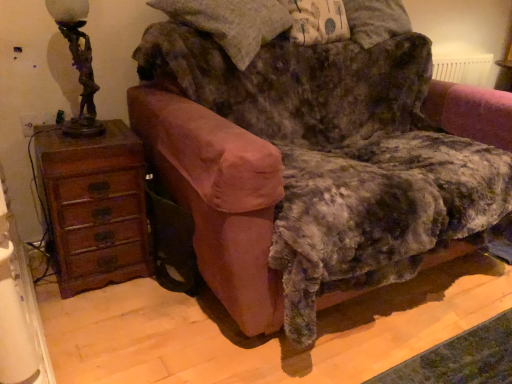
This screenshot has height=384, width=512. What are the coordinates of `bronze statue-like at left` in the screenshot? It's located at (78, 63).

In order to click on brown wooden chest of drawers at left in this screenshot , I will do `click(95, 206)`.

Could you tell me if bronze statue-like at left is facing brown wooden chest of drawers at left?

No, bronze statue-like at left is not aimed at brown wooden chest of drawers at left.

Is bronze statue-like at left next to brown wooden chest of drawers at left and touching it?

They are not placed beside each other.

Is bronze statue-like at left taller or shorter than brown wooden chest of drawers at left?

Considering their sizes, bronze statue-like at left has less height than brown wooden chest of drawers at left.

Considering the relative sizes of bronze statue-like at left and brown wooden chest of drawers at left in the image provided, is bronze statue-like at left bigger than brown wooden chest of drawers at left?

No.

Are brown wooden chest of drawers at left and bronze statue-like at left far apart?

No, brown wooden chest of drawers at left is not far from bronze statue-like at left.

Is brown wooden chest of drawers at left situated inside bronze statue-like at left or outside?

brown wooden chest of drawers at left is not inside bronze statue-like at left, it's outside.

Considering the positions of objects brown wooden chest of drawers at left and bronze statue-like at left in the image provided, who is in front, brown wooden chest of drawers at left or bronze statue-like at left?

Positioned in front is bronze statue-like at left.

Is brown wooden chest of drawers at left oriented away from bronze statue-like at left?

No.

Which is in front, point (483, 233) or point (75, 43)?

Positioned in front is point (75, 43).

From a real-world perspective, who is located lower, velvet pink armchair at center or bronze statue-like at left?

velvet pink armchair at center, from a real-world perspective.

Can bronze statue-like at left be found inside velvet pink armchair at center?

No, bronze statue-like at left is not surrounded by velvet pink armchair at center.

Measure the distance from velvet pink armchair at center to bronze statue-like at left.

velvet pink armchair at center and bronze statue-like at left are 28.04 inches apart from each other.

Is brown wooden chest of drawers at left in contact with velvet pink armchair at center?

They are not placed beside each other.

Considering the relative sizes of brown wooden chest of drawers at left and velvet pink armchair at center in the image provided, is brown wooden chest of drawers at left shorter than velvet pink armchair at center?

Yes.

Is brown wooden chest of drawers at left oriented away from velvet pink armchair at center?

No, brown wooden chest of drawers at left's orientation is not away from velvet pink armchair at center.

Looking at this image, is bronze statue-like at left further to camera compared to velvet pink armchair at center?

Yes, bronze statue-like at left is further from the viewer.

Is there a large distance between bronze statue-like at left and velvet pink armchair at center?

Actually, bronze statue-like at left and velvet pink armchair at center are a little close together.

From a real-world perspective, is bronze statue-like at left located higher than velvet pink armchair at center?

Indeed, from a real-world perspective, bronze statue-like at left stands above velvet pink armchair at center.

From the picture: Are velvet pink armchair at center and brown wooden chest of drawers at left making contact?

No, velvet pink armchair at center is not touching brown wooden chest of drawers at left.

Does velvet pink armchair at center lie in front of brown wooden chest of drawers at left?

Yes, it is.

How distant is velvet pink armchair at center from brown wooden chest of drawers at left?

velvet pink armchair at center is 21.57 inches from brown wooden chest of drawers at left.

Is velvet pink armchair at center oriented towards brown wooden chest of drawers at left?

No.

Locate an element on the screen. The width and height of the screenshot is (512, 384). the chest of drawers located behind the bronze statue-like at left is located at coordinates (95, 206).

Where is `table lamp lying above the brown wooden chest of drawers at left (from the image's perspective)`? table lamp lying above the brown wooden chest of drawers at left (from the image's perspective) is located at coordinates (78, 63).

Which object lies further to the anchor point brown wooden chest of drawers at left, velvet pink armchair at center or bronze statue-like at left?

Among the two, velvet pink armchair at center is located further to brown wooden chest of drawers at left.

Looking at the image, which one is located further to velvet pink armchair at center, bronze statue-like at left or brown wooden chest of drawers at left?

bronze statue-like at left is further to velvet pink armchair at center.

From the image, which object appears to be nearer to bronze statue-like at left, velvet pink armchair at center or brown wooden chest of drawers at left?

brown wooden chest of drawers at left is positioned closer to the anchor bronze statue-like at left.

Consider the image. Considering their positions, is brown wooden chest of drawers at left positioned closer to bronze statue-like at left than velvet pink armchair at center?

Based on the image, brown wooden chest of drawers at left appears to be nearer to bronze statue-like at left.

From the image, which object appears to be nearer to velvet pink armchair at center, brown wooden chest of drawers at left or bronze statue-like at left?

brown wooden chest of drawers at left lies closer to velvet pink armchair at center than the other object.

Considering their positions, is bronze statue-like at left positioned further to brown wooden chest of drawers at left than velvet pink armchair at center?

velvet pink armchair at center is positioned further to the anchor brown wooden chest of drawers at left.

The image size is (512, 384). In order to click on table lamp between brown wooden chest of drawers at left and velvet pink armchair at center in this screenshot , I will do `click(78, 63)`.